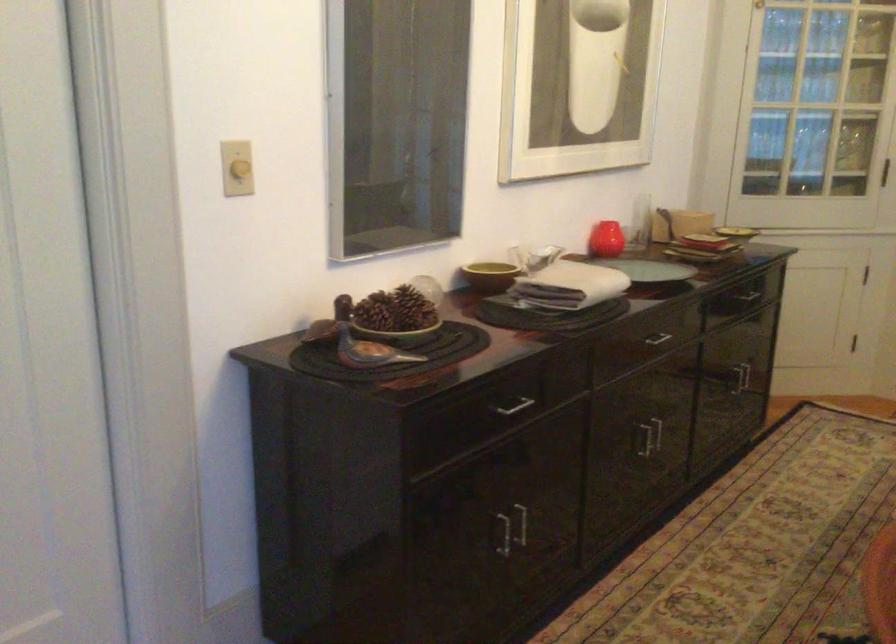
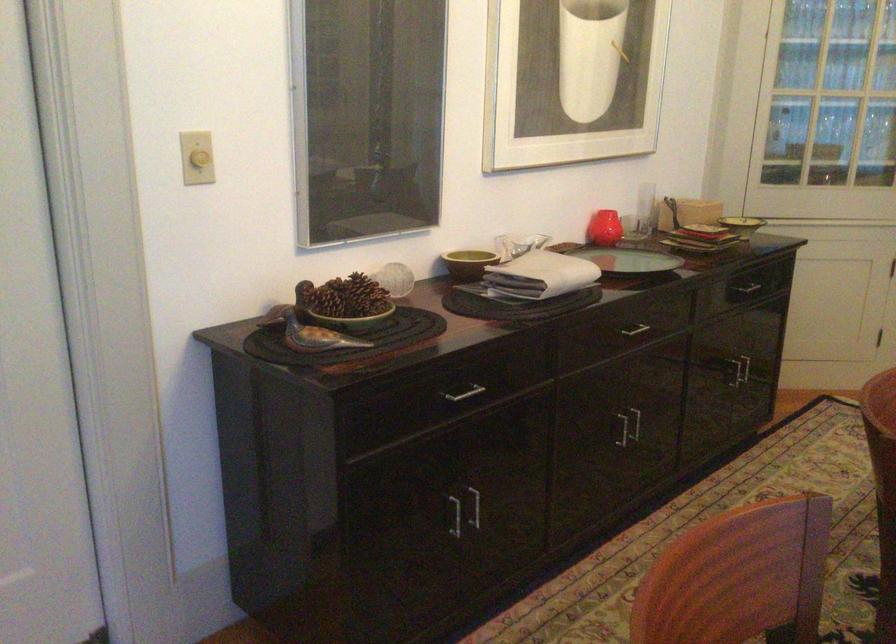
The point at (519, 524) is marked in the first image. Where is the corresponding point in the second image?

(474, 507)